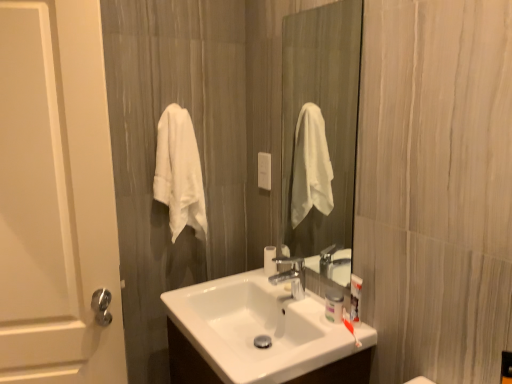
Question: Is clear glass mirror at center spatially inside white glossy sink at center, or outside of it?

Choices:
 (A) inside
 (B) outside

Answer: (B)

Question: In terms of height, does clear glass mirror at center look taller or shorter compared to white glossy sink at center?

Choices:
 (A) tall
 (B) short

Answer: (A)

Question: Considering the real-world distances, which object is closest to the white soft towel at left?

Choices:
 (A) clear glass mirror at center
 (B) white matte door at left
 (C) white glossy sink at center

Answer: (B)

Question: Which object is positioned farthest from the white soft towel at left?

Choices:
 (A) white matte door at left
 (B) white glossy sink at center
 (C) clear glass mirror at center

Answer: (C)